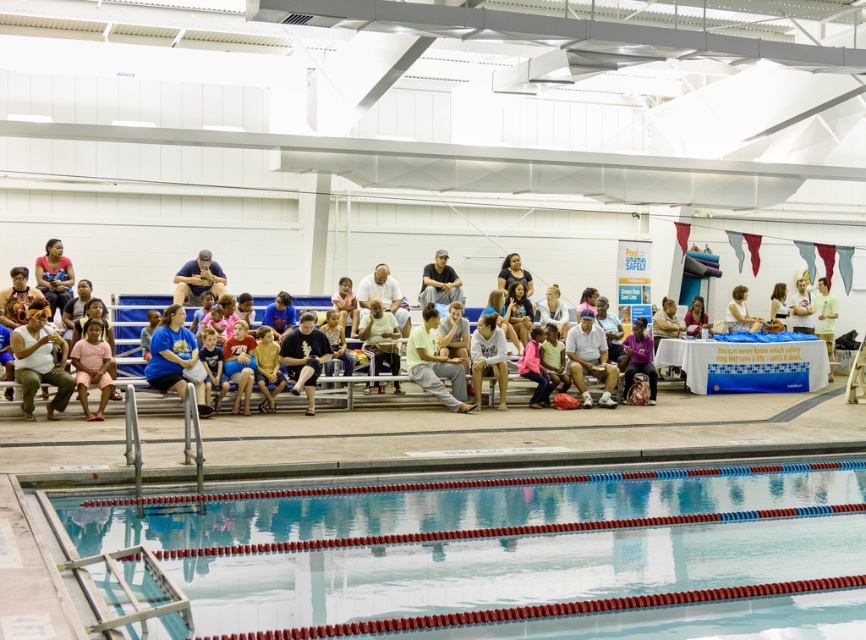
You are a photographer positioned at the poolside and want to capture both the white cotton tank top at left and the light yellow fabric shirt at center in the same frame. Which direction should you move to ensure both are visible?

You should move to the right so that both the white cotton tank top at left and the light yellow fabric shirt at center are visible in your frame since the white cotton tank top at left is to the left of the light yellow fabric shirt at center.

You are a photographer positioned at the pool edge. You need to capture a photo of both the blue jersey at center and the light yellow fabric shirt at center. Which clothing item will appear taller in the photo?

The light yellow fabric shirt at center will appear taller in the photo because it is taller than the blue jersey at center.

You are a photographer standing at the back of the seating area. You want to take a photo of the matte white people at center and the matte black shirt at upper left. Which object should you adjust your camera focus to first to ensure both are in the frame?

The matte black shirt at upper left should be focused on first since the matte white people at center are positioned below it, so adjusting focus starting from the upper left will help capture both in the frame.